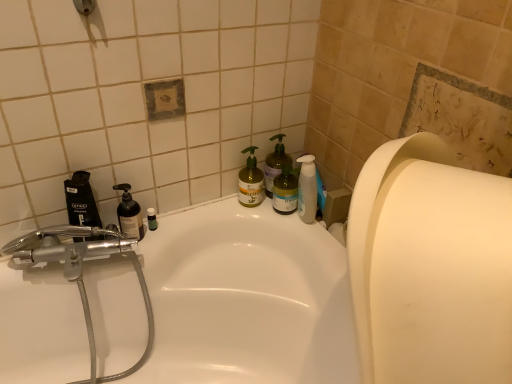
Question: In the image, is chrome metallic faucet at left on the left side or the right side of white glossy bathtub at center?

Choices:
 (A) right
 (B) left

Answer: (B)

Question: From a real-world perspective, is chrome metallic faucet at left positioned above or below white glossy bathtub at center?

Choices:
 (A) above
 (B) below

Answer: (A)

Question: Which of these objects is positioned farthest from the white glossy bathtub at center?

Choices:
 (A) matte silver showerhead at upper left
 (B) green matte pump bottle at upper right, positioned as the third cleaning product in left-to-right order
 (C) chrome metallic faucet at left
 (D) green matte bottle at center, the second cleaning product viewed from the right
 (E) black plastic mouthwash at left

Answer: (A)

Question: Based on their relative distances, which object is nearer to the green matte bottle at center, the 2th cleaning product positioned from the left?

Choices:
 (A) white matte paper towel at right
 (B) white glossy bathtub at center
 (C) chrome metallic faucet at left
 (D) matte silver showerhead at upper left
 (E) transparent plastic bottle at left

Answer: (E)